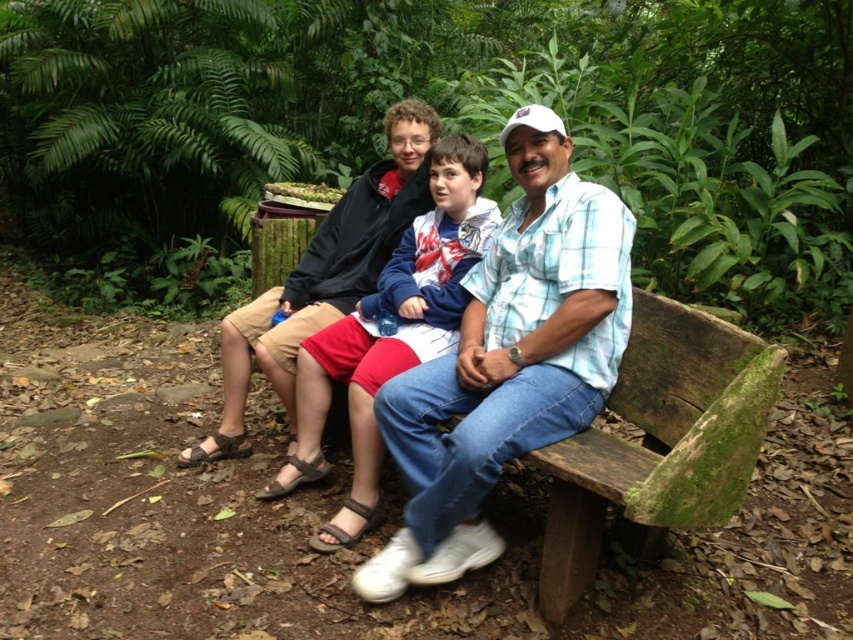
Between green mossy wood bench at right and blue plaid shirt at center, which one has less height?

green mossy wood bench at right

Between point (670, 445) and point (339, 342), which one is positioned in front?

Point (670, 445) is more forward.

Find the location of `green mossy wood bench at right`. green mossy wood bench at right is located at coordinates (659, 442).

Is light blue plaid shirt at center smaller than blue plaid shirt at center?

Incorrect, light blue plaid shirt at center is not smaller in size than blue plaid shirt at center.

Between point (579, 326) and point (498, 220), which one is positioned in front?

Point (579, 326) is more forward.

In order to click on light blue plaid shirt at center in this screenshot , I will do `click(508, 360)`.

Can you confirm if light blue plaid shirt at center is wider than green mossy wood bench at right?

Correct, the width of light blue plaid shirt at center exceeds that of green mossy wood bench at right.

Does light blue plaid shirt at center have a lesser width compared to green mossy wood bench at right?

No, light blue plaid shirt at center is not thinner than green mossy wood bench at right.

Which is behind, point (619, 344) or point (724, 403)?

The point (619, 344) is more distant.

I want to click on light blue plaid shirt at center, so click(x=508, y=360).